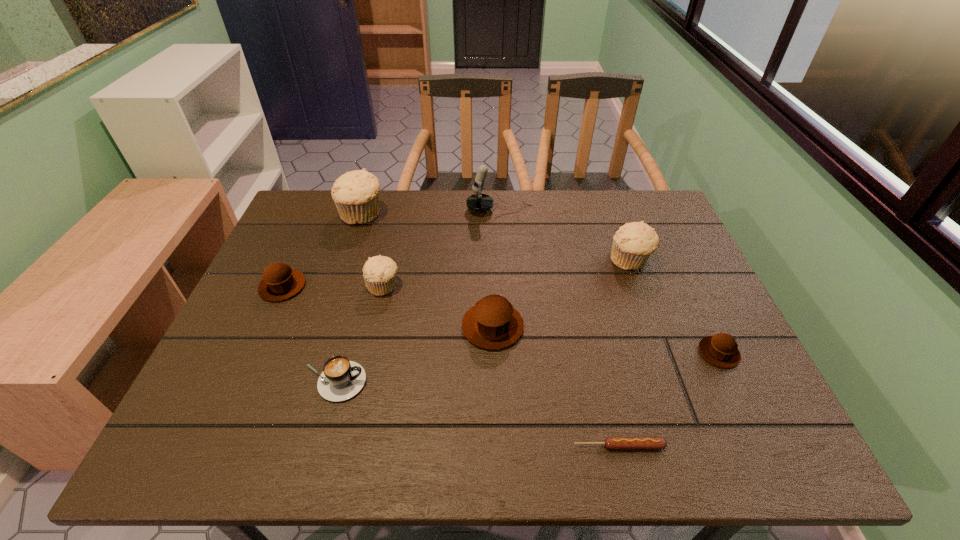
Locate an element on the screen. This screenshot has height=540, width=960. the third closest brown muffin to the microphone is located at coordinates (721, 350).

In order to click on brown muffin identified as the closest to the second smallest brown muffin in this screenshot , I will do `click(493, 323)`.

Find the location of a particular element. free location that satisfies the following two spatial constraints: 1. on the back side of the microphone; 2. on the right side of the smallest beige muffin is located at coordinates 400,210.

Where is `free space that satisfies the following two spatial constraints: 1. on the front side of the second brown muffin from right to left; 2. on the left side of the second shortest muffin`? Image resolution: width=960 pixels, height=540 pixels. free space that satisfies the following two spatial constraints: 1. on the front side of the second brown muffin from right to left; 2. on the left side of the second shortest muffin is located at coordinates (264, 327).